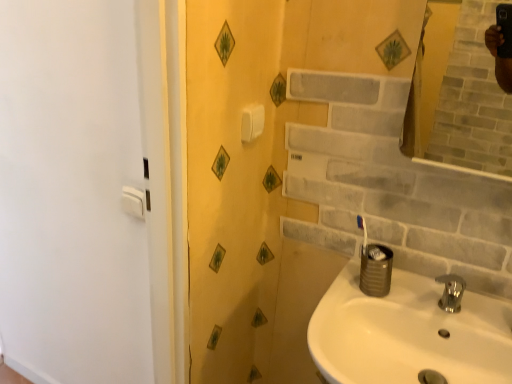
What do you see at coordinates (408, 333) in the screenshot? Image resolution: width=512 pixels, height=384 pixels. I see `white glossy sink at lower right` at bounding box center [408, 333].

Where is `white glossy sink at lower right`? The height and width of the screenshot is (384, 512). white glossy sink at lower right is located at coordinates (408, 333).

The height and width of the screenshot is (384, 512). What do you see at coordinates (451, 292) in the screenshot?
I see `polished chrome faucet at lower right` at bounding box center [451, 292].

The image size is (512, 384). In order to click on polished chrome faucet at lower right in this screenshot , I will do `click(451, 292)`.

Where is `white glossy sink at lower right`? The height and width of the screenshot is (384, 512). white glossy sink at lower right is located at coordinates (408, 333).

In the image, is white glossy sink at lower right on the left side or the right side of polished chrome faucet at lower right?

In the image, white glossy sink at lower right appears on the left side of polished chrome faucet at lower right.

Is white glossy sink at lower right behind polished chrome faucet at lower right?

No, it is not.

Does point (356, 319) come farther from viewer compared to point (458, 302)?

Yes, point (356, 319) is behind point (458, 302).

From the image's perspective, who appears lower, white glossy sink at lower right or polished chrome faucet at lower right?

white glossy sink at lower right appears lower in the image.

From a real-world perspective, is white glossy sink at lower right physically above polished chrome faucet at lower right?

No, from a real-world perspective, white glossy sink at lower right is not on top of polished chrome faucet at lower right.

Looking at this image, looking at their sizes, would you say white glossy sink at lower right is wider or thinner than polished chrome faucet at lower right?

Considering their sizes, white glossy sink at lower right looks broader than polished chrome faucet at lower right.

Looking at this image, which of these two, white glossy sink at lower right or polished chrome faucet at lower right, stands shorter?

polished chrome faucet at lower right is shorter.

Which of these two, white glossy sink at lower right or polished chrome faucet at lower right, is smaller?

polished chrome faucet at lower right.

Is polished chrome faucet at lower right surrounded by white glossy sink at lower right?

Actually, polished chrome faucet at lower right is outside white glossy sink at lower right.

Would you consider white glossy sink at lower right to be distant from polished chrome faucet at lower right?

white glossy sink at lower right is near polished chrome faucet at lower right, not far away.

Is white glossy sink at lower right aimed at polished chrome faucet at lower right?

No, white glossy sink at lower right is not facing towards polished chrome faucet at lower right.

Where is `tap that appears on the right of white glossy sink at lower right`? Image resolution: width=512 pixels, height=384 pixels. tap that appears on the right of white glossy sink at lower right is located at coordinates (451, 292).

Between polished chrome faucet at lower right and white glossy sink at lower right, which one appears on the right side from the viewer's perspective?

From the viewer's perspective, polished chrome faucet at lower right appears more on the right side.

Between polished chrome faucet at lower right and white glossy sink at lower right, which one is positioned behind?

polished chrome faucet at lower right is further away from the camera.

Is point (461, 281) positioned behind point (366, 353)?

Yes, point (461, 281) is behind point (366, 353).

From the image's perspective, is polished chrome faucet at lower right located above or below white glossy sink at lower right?

polished chrome faucet at lower right is above white glossy sink at lower right.

From a real-world perspective, is polished chrome faucet at lower right physically located above or below white glossy sink at lower right?

From a real-world perspective, polished chrome faucet at lower right is physically above white glossy sink at lower right.

Is polished chrome faucet at lower right thinner than white glossy sink at lower right?

Yes.

Can you confirm if polished chrome faucet at lower right is shorter than white glossy sink at lower right?

Correct, polished chrome faucet at lower right is not as tall as white glossy sink at lower right.

In terms of size, does polished chrome faucet at lower right appear bigger or smaller than white glossy sink at lower right?

In the image, polished chrome faucet at lower right appears to be smaller than white glossy sink at lower right.

Can we say polished chrome faucet at lower right lies outside white glossy sink at lower right?

Yes, polished chrome faucet at lower right is located beyond the bounds of white glossy sink at lower right.

Can you see polished chrome faucet at lower right touching white glossy sink at lower right?

polished chrome faucet at lower right and white glossy sink at lower right are clearly separated.

Is polished chrome faucet at lower right facing away from white glossy sink at lower right?

No, white glossy sink at lower right is not at the back of polished chrome faucet at lower right.

How different are the orientations of polished chrome faucet at lower right and white glossy sink at lower right in degrees?

polished chrome faucet at lower right and white glossy sink at lower right are facing 5.39e-05 degrees away from each other.

The height and width of the screenshot is (384, 512). What are the coordinates of `sink lying on the left of polished chrome faucet at lower right` in the screenshot? It's located at (408, 333).

What are the coordinates of `sink in front of the polished chrome faucet at lower right` in the screenshot? It's located at (408, 333).

Find the location of a particular element. The height and width of the screenshot is (384, 512). sink beneath the polished chrome faucet at lower right (from a real-world perspective) is located at coordinates (408, 333).